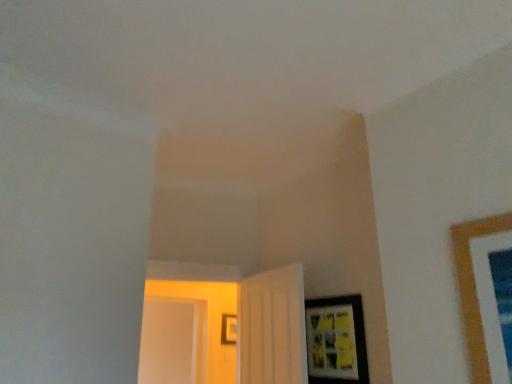
The image size is (512, 384). I want to click on matte black picture frame at lower right, the second picture frame positioned from the back, so 336,340.

What do you see at coordinates (336, 340) in the screenshot? I see `matte black picture frame at lower right, positioned as the 1th picture frame in top-to-bottom order` at bounding box center [336, 340].

Identify the location of white glossy door at center, acting as the 1th door starting from the left. (249, 325).

This screenshot has width=512, height=384. Describe the element at coordinates (249, 325) in the screenshot. I see `white glossy door at center, which ranks as the 2th door in right-to-left order` at that location.

Describe the element at coordinates (172, 342) in the screenshot. The width and height of the screenshot is (512, 384). I see `transparent glass door at left` at that location.

You are a GUI agent. You are given a task and a screenshot of the screen. Output one action in this format:
    pyautogui.click(x=<x>, y=<y>)
    Task: Click on the transparent glass door at left
    The width and height of the screenshot is (512, 384).
    Given the screenshot: What is the action you would take?
    pyautogui.click(x=172, y=342)

What do you see at coordinates (272, 328) in the screenshot?
I see `white matte door at center, the first door from the right` at bounding box center [272, 328].

This screenshot has height=384, width=512. What are the coordinates of `matte black picture frame at center, which is the second picture frame from front to back` in the screenshot? It's located at (229, 329).

In the scene shown: Is white glossy door at center, acting as the 1th door starting from the left, turned away from matte black picture frame at center, which is the 2th picture frame in top-to-bottom order?

That's right, white glossy door at center, acting as the 1th door starting from the left, is facing away from matte black picture frame at center, which is the 2th picture frame in top-to-bottom order.

Can you confirm if white glossy door at center, acting as the 1th door starting from the left, is positioned to the left of matte black picture frame at center, which ranks as the first picture frame in back-to-front order?

Yes.

Based on the photo, would you say matte black picture frame at center, acting as the second picture frame starting from the right, is part of white glossy door at center, acting as the 1th door starting from the left,'s contents?

No, matte black picture frame at center, acting as the second picture frame starting from the right, is not surrounded by white glossy door at center, acting as the 1th door starting from the left.

Based on the photo, is white glossy door at center, acting as the 1th door starting from the left, positioned far away from matte black picture frame at center, which ranks as the first picture frame in back-to-front order?

white glossy door at center, acting as the 1th door starting from the left, is near matte black picture frame at center, which ranks as the first picture frame in back-to-front order, not far away.

From a real-world perspective, between matte black picture frame at lower right, placed as the 1th picture frame when sorted from front to back, and matte black picture frame at center, acting as the second picture frame starting from the right, who is vertically lower?

matte black picture frame at lower right, placed as the 1th picture frame when sorted from front to back, is physically lower.

This screenshot has height=384, width=512. Find the location of `picture frame above the matte black picture frame at lower right, the first picture frame positioned from the right (from a real-world perspective)`. picture frame above the matte black picture frame at lower right, the first picture frame positioned from the right (from a real-world perspective) is located at coordinates (229, 329).

Is matte black picture frame at lower right, the first picture frame positioned from the right, positioned behind matte black picture frame at center, acting as the second picture frame starting from the right?

No, matte black picture frame at lower right, the first picture frame positioned from the right, is closer to the viewer.

Is matte black picture frame at center, arranged as the 1th picture frame when ordered from the bottom, at the back of matte black picture frame at lower right, which is the 2th picture frame from bottom to top?

That's not correct — matte black picture frame at lower right, which is the 2th picture frame from bottom to top, is not looking away from matte black picture frame at center, arranged as the 1th picture frame when ordered from the bottom.

Is matte black picture frame at center, which is counted as the first picture frame, starting from the left, spatially inside transparent glass door at left, or outside of it?

matte black picture frame at center, which is counted as the first picture frame, starting from the left, is not inside transparent glass door at left, it's outside.

From the image's perspective, relative to transparent glass door at left, is matte black picture frame at center, which is the second picture frame from front to back, above or below?

matte black picture frame at center, which is the second picture frame from front to back, is below transparent glass door at left.

Considering their positions, is matte black picture frame at center, arranged as the 1th picture frame when ordered from the bottom, located in front of or behind transparent glass door at left?

In the image, matte black picture frame at center, arranged as the 1th picture frame when ordered from the bottom, appears behind transparent glass door at left.

From the picture: Between matte black picture frame at center, which is counted as the first picture frame, starting from the left, and transparent glass door at left, which one appears on the left side from the viewer's perspective?

transparent glass door at left is more to the left.

Which of these two, matte black picture frame at lower right, which is the 2th picture frame from bottom to top, or white glossy door at center, acting as the 1th door starting from the left, is bigger?

With larger size is white glossy door at center, acting as the 1th door starting from the left.

Could you measure the distance between matte black picture frame at lower right, the 2th picture frame viewed from the left, and white glossy door at center, which ranks as the 2th door in right-to-left order?

The distance of matte black picture frame at lower right, the 2th picture frame viewed from the left, from white glossy door at center, which ranks as the 2th door in right-to-left order, is 2.36 meters.

Is white glossy door at center, which ranks as the 2th door in right-to-left order, surrounded by matte black picture frame at lower right, which is the 2th picture frame from bottom to top?

No, matte black picture frame at lower right, which is the 2th picture frame from bottom to top, does not contain white glossy door at center, which ranks as the 2th door in right-to-left order.

Is matte black picture frame at lower right, the first picture frame positioned from the right, further to the viewer compared to white glossy door at center, acting as the 1th door starting from the left?

No, matte black picture frame at lower right, the first picture frame positioned from the right, is in front of white glossy door at center, acting as the 1th door starting from the left.

Consider the image. How many degrees apart are the facing directions of white glossy door at center, which ranks as the 2th door in right-to-left order, and white matte door at center, the first door from the right?

The angular difference between white glossy door at center, which ranks as the 2th door in right-to-left order, and white matte door at center, the first door from the right, is 81.2 degrees.

Is white glossy door at center, acting as the 1th door starting from the left, not within white matte door at center, the first door from the right?

white glossy door at center, acting as the 1th door starting from the left, lies outside white matte door at center, the first door from the right,'s area.

Considering the sizes of objects white glossy door at center, which ranks as the 2th door in right-to-left order, and white matte door at center, the second door in the left-to-right sequence, in the image provided, who is bigger, white glossy door at center, which ranks as the 2th door in right-to-left order, or white matte door at center, the second door in the left-to-right sequence,?

Bigger between the two is white glossy door at center, which ranks as the 2th door in right-to-left order.

Which object is closer to the camera, white glossy door at center, acting as the 1th door starting from the left, or white matte door at center, the second door in the left-to-right sequence?

Positioned in front is white matte door at center, the second door in the left-to-right sequence.

Is the surface of transparent glass door at left in direct contact with white matte door at center, the first door from the right?

No, transparent glass door at left is not with white matte door at center, the first door from the right.

Can you confirm if transparent glass door at left is taller than white matte door at center, the first door from the right?

Correct, transparent glass door at left is much taller as white matte door at center, the first door from the right.

Who is bigger, transparent glass door at left or white matte door at center, the first door from the right?

Bigger between the two is transparent glass door at left.

Which is behind, point (158, 340) or point (268, 305)?

The point (158, 340) is farther.

From a real-world perspective, which is physically below, white glossy door at center, acting as the 1th door starting from the left, or matte black picture frame at lower right, positioned as the 1th picture frame in top-to-bottom order?

matte black picture frame at lower right, positioned as the 1th picture frame in top-to-bottom order.

Considering the relative sizes of white glossy door at center, which ranks as the 2th door in right-to-left order, and matte black picture frame at lower right, which is the 2th picture frame from bottom to top, in the image provided, is white glossy door at center, which ranks as the 2th door in right-to-left order, wider than matte black picture frame at lower right, which is the 2th picture frame from bottom to top,?

Indeed, white glossy door at center, which ranks as the 2th door in right-to-left order, has a greater width compared to matte black picture frame at lower right, which is the 2th picture frame from bottom to top.

From the picture: Is white glossy door at center, which ranks as the 2th door in right-to-left order, facing away from matte black picture frame at lower right, which is the 2th picture frame from bottom to top?

No.

Between white glossy door at center, acting as the 1th door starting from the left, and matte black picture frame at lower right, positioned as the 1th picture frame in top-to-bottom order, which one appears on the right side from the viewer's perspective?

matte black picture frame at lower right, positioned as the 1th picture frame in top-to-bottom order, is more to the right.

You are a GUI agent. You are given a task and a screenshot of the screen. Output one action in this format:
    pyautogui.click(x=<x>, y=<y>)
    Task: Click on the 1st door below the matte black picture frame at center, which is the second picture frame from front to back (from a real-world perspective)
    This screenshot has width=512, height=384.
    Given the screenshot: What is the action you would take?
    pyautogui.click(x=249, y=325)

At what (x,y) coordinates should I click in order to perform the action: click on picture frame lying behind the matte black picture frame at lower right, placed as the 1th picture frame when sorted from front to back. Please return your answer as a coordinate pair (x, y). Looking at the image, I should click on (229, 329).

When comparing their distances from transparent glass door at left, does matte black picture frame at center, which is the 2th picture frame in top-to-bottom order, or matte black picture frame at lower right, the second picture frame positioned from the back, seem closer?

matte black picture frame at center, which is the 2th picture frame in top-to-bottom order, is closer to transparent glass door at left.

When comparing their distances from matte black picture frame at center, which is counted as the first picture frame, starting from the left, does white glossy door at center, which ranks as the 2th door in right-to-left order, or transparent glass door at left seem closer?

Among the two, white glossy door at center, which ranks as the 2th door in right-to-left order, is located nearer to matte black picture frame at center, which is counted as the first picture frame, starting from the left.

Looking at the image, which one is located further to matte black picture frame at center, arranged as the 1th picture frame when ordered from the bottom, matte black picture frame at lower right, which is the 2th picture frame from bottom to top, or transparent glass door at left?

matte black picture frame at lower right, which is the 2th picture frame from bottom to top, is further to matte black picture frame at center, arranged as the 1th picture frame when ordered from the bottom.

Looking at the image, which one is located closer to matte black picture frame at lower right, the 2th picture frame viewed from the left, white glossy door at center, acting as the 1th door starting from the left, or matte black picture frame at center, acting as the second picture frame starting from the right?

matte black picture frame at center, acting as the second picture frame starting from the right.

Considering their positions, is transparent glass door at left positioned further to matte black picture frame at lower right, positioned as the 1th picture frame in top-to-bottom order, than white matte door at center, the first door from the right?

Among the two, transparent glass door at left is located further to matte black picture frame at lower right, positioned as the 1th picture frame in top-to-bottom order.

Estimate the real-world distances between objects in this image. Which object is further from transparent glass door at left, matte black picture frame at lower right, which is the 2th picture frame from bottom to top, or white matte door at center, the first door from the right?

matte black picture frame at lower right, which is the 2th picture frame from bottom to top.

Estimate the real-world distances between objects in this image. Which object is closer to matte black picture frame at center, which is the second picture frame from front to back, white glossy door at center, which ranks as the 2th door in right-to-left order, or matte black picture frame at lower right, positioned as the 1th picture frame in top-to-bottom order?

Based on the image, white glossy door at center, which ranks as the 2th door in right-to-left order, appears to be nearer to matte black picture frame at center, which is the second picture frame from front to back.

Estimate the real-world distances between objects in this image. Which object is further from white glossy door at center, which ranks as the 2th door in right-to-left order, transparent glass door at left or matte black picture frame at center, arranged as the 1th picture frame when ordered from the bottom?

Among the two, transparent glass door at left is located further to white glossy door at center, which ranks as the 2th door in right-to-left order.

Find the location of a particular element. The height and width of the screenshot is (384, 512). door between white matte door at center, the second door in the left-to-right sequence, and matte black picture frame at center, arranged as the 1th picture frame when ordered from the bottom, in the front-back direction is located at coordinates (249, 325).

Locate an element on the screen. This screenshot has width=512, height=384. door situated between white glossy door at center, acting as the 1th door starting from the left, and matte black picture frame at lower right, placed as the 1th picture frame when sorted from front to back, from left to right is located at coordinates (272, 328).

Where is `glass door located between white glossy door at center, which ranks as the 2th door in right-to-left order, and matte black picture frame at center, which is the 2th picture frame in top-to-bottom order, in the depth direction`? This screenshot has width=512, height=384. glass door located between white glossy door at center, which ranks as the 2th door in right-to-left order, and matte black picture frame at center, which is the 2th picture frame in top-to-bottom order, in the depth direction is located at coordinates (172, 342).

Locate an element on the screen. glass door between matte black picture frame at lower right, placed as the 1th picture frame when sorted from front to back, and matte black picture frame at center, which is the second picture frame from front to back, along the z-axis is located at coordinates (172, 342).